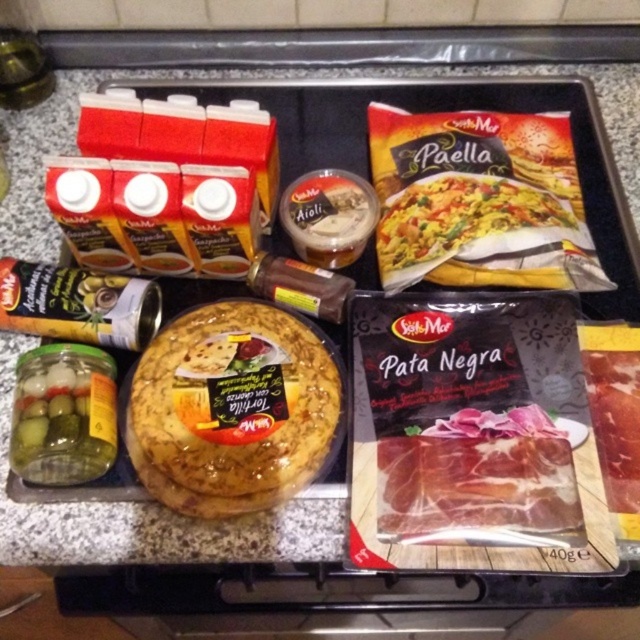
Question: Considering the relative positions of translucent plastic tortilla at center and semi-dry cured ham at center in the image provided, where is translucent plastic tortilla at center located with respect to semi-dry cured ham at center?

Choices:
 (A) below
 (B) above

Answer: (B)

Question: Which is farther from the yellow matte paella packet at upper right?

Choices:
 (A) translucent plastic tortilla at center
 (B) semi-dry cured ham at center

Answer: (A)

Question: Is translucent plastic tortilla at center closer to camera compared to yellow matte paella packet at upper right?

Choices:
 (A) no
 (B) yes

Answer: (B)

Question: Among these points, which one is farthest from the camera?

Choices:
 (A) (163, 339)
 (B) (417, 500)

Answer: (A)

Question: Does translucent plastic tortilla at center have a greater width compared to yellow matte paella packet at upper right?

Choices:
 (A) yes
 (B) no

Answer: (B)

Question: Considering the real-world distances, which object is farthest from the translucent plastic tortilla at center?

Choices:
 (A) yellow matte paella packet at upper right
 (B) semi-dry cured ham at center

Answer: (A)